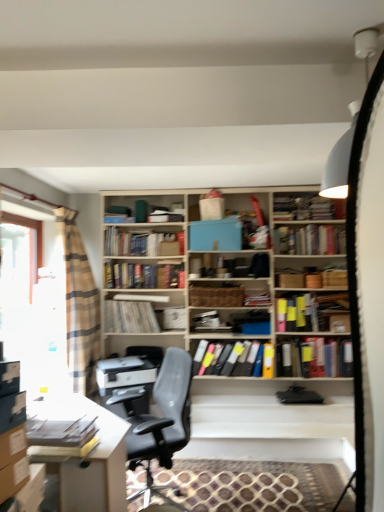
The height and width of the screenshot is (512, 384). What do you see at coordinates (134, 243) in the screenshot? I see `hardcover book at center, the 7th book viewed from the front` at bounding box center [134, 243].

The image size is (384, 512). Identify the location of hardcover book at center, which appears as the 2th book when viewed from the back. (134, 243).

What do you see at coordinates (79, 306) in the screenshot? I see `beige plaid curtain at left` at bounding box center [79, 306].

Describe the element at coordinates (64, 437) in the screenshot. I see `matte gray book at lower left, the first book when ordered from front to back` at that location.

What is the approximate width of brown woven basket at center?

brown woven basket at center is 26.05 centimeters in width.

The width and height of the screenshot is (384, 512). What do you see at coordinates (160, 418) in the screenshot? I see `black leather chair at center` at bounding box center [160, 418].

This screenshot has height=512, width=384. I want to click on hardcover book at center, the 7th book viewed from the front, so click(x=134, y=243).

Considering their positions, is hardcover books at center, positioned as the sixth book in front-to-back order, located in front of or behind beige plaid curtain at left?

hardcover books at center, positioned as the sixth book in front-to-back order, is behind beige plaid curtain at left.

You are a GUI agent. You are given a task and a screenshot of the screen. Output one action in this format:
    pyautogui.click(x=<x>, y=<y>)
    Task: Click on the curtain lying on the left of hardcover books at center, which is counted as the third book, starting from the back
    Image resolution: width=384 pixels, height=512 pixels.
    Given the screenshot: What is the action you would take?
    pyautogui.click(x=79, y=306)

Is hardcover books at center, which is counted as the third book, starting from the back, oriented towards beige plaid curtain at left?

No, hardcover books at center, which is counted as the third book, starting from the back, is not oriented towards beige plaid curtain at left.

From the picture: Between white paper at center, the 1th book when ordered from back to front, and matte white desk at lower left, which one appears on the left side from the viewer's perspective?

matte white desk at lower left.

Is white paper at center, the eighth book positioned from the front, in front of or behind matte white desk at lower left in the image?

Clearly, white paper at center, the eighth book positioned from the front, is behind matte white desk at lower left.

From the image's perspective, which one is positioned lower, white paper at center, the 1th book when ordered from back to front, or matte white desk at lower left?

matte white desk at lower left is shown below in the image.

Between white paper at center, the eighth book positioned from the front, and matte white desk at lower left, which one has less height?

Standing shorter between the two is white paper at center, the eighth book positioned from the front.

Does black leather chair at center lie in front of clear glass window at left?

Yes, black leather chair at center is in front of clear glass window at left.

Is black leather chair at center looking in the opposite direction of clear glass window at left?

No, black leather chair at center's orientation is not away from clear glass window at left.

Is black leather chair at center positioned far away from clear glass window at left?

black leather chair at center is positioned a significant distance from clear glass window at left.

From the picture: Who is taller, black leather chair at center or clear glass window at left?

With more height is clear glass window at left.

Does hardcover books at upper right, marked as the 4th book in a front-to-back arrangement, turn towards white paper at center, the 1th book when ordered from back to front?

No.

How many degrees apart are the facing directions of hardcover books at upper right, the fifth book positioned from the back, and white paper at center, the 1th book when ordered from back to front?

There is a 1.74-degree angle between the facing directions of hardcover books at upper right, the fifth book positioned from the back, and white paper at center, the 1th book when ordered from back to front.

Looking at this image, from a real-world perspective, between hardcover books at upper right, marked as the 4th book in a front-to-back arrangement, and white paper at center, the 1th book when ordered from back to front, who is vertically lower?

In real-world perspective, white paper at center, the 1th book when ordered from back to front, is lower.

Does multicolored plastic folders at center, positioned as the sixth book in back-to-front order, have a lesser height compared to hardcover books at center, which is counted as the third book, starting from the back?

No.

From the image's perspective, which one is positioned higher, multicolored plastic folders at center, positioned as the sixth book in back-to-front order, or hardcover books at center, positioned as the sixth book in front-to-back order?

From the image's view, hardcover books at center, positioned as the sixth book in front-to-back order, is above.

Which point is more distant from viewer, (308, 338) or (131, 275)?

The point (131, 275) is more distant.

Is multicolored plastic folders at center, which is the 3th book from front to back, oriented towards hardcover books at center, positioned as the sixth book in front-to-back order?

No, multicolored plastic folders at center, which is the 3th book from front to back, is not oriented towards hardcover books at center, positioned as the sixth book in front-to-back order.

The height and width of the screenshot is (512, 384). Find the location of `desk located underneath the hardcover books at upper right, the fifth book positioned from the back (from a real-world perspective)`. desk located underneath the hardcover books at upper right, the fifth book positioned from the back (from a real-world perspective) is located at coordinates (90, 461).

Is hardcover books at upper right, the fifth book positioned from the back, oriented away from matte white desk at lower left?

That's not correct — hardcover books at upper right, the fifth book positioned from the back, is not looking away from matte white desk at lower left.

Measure the distance from hardcover books at upper right, marked as the 4th book in a front-to-back arrangement, to matte white desk at lower left.

The distance of hardcover books at upper right, marked as the 4th book in a front-to-back arrangement, from matte white desk at lower left is 2.52 meters.

Considering the positions of objects hardcover books at upper right, the fifth book positioned from the back, and matte white desk at lower left in the image provided, who is behind, hardcover books at upper right, the fifth book positioned from the back, or matte white desk at lower left?

Positioned behind is hardcover books at upper right, the fifth book positioned from the back.

Is the depth of brown woven basket at center less than that of hardcover book at center, the 7th book viewed from the front?

Yes, brown woven basket at center is in front of hardcover book at center, the 7th book viewed from the front.

Is brown woven basket at center not near hardcover book at center, which appears as the 2th book when viewed from the back?

brown woven basket at center is actually quite close to hardcover book at center, which appears as the 2th book when viewed from the back.

From a real-world perspective, is brown woven basket at center physically located above or below hardcover book at center, the 7th book viewed from the front?

From a real-world perspective, brown woven basket at center is physically below hardcover book at center, the 7th book viewed from the front.

Locate an element on the screen. This screenshot has height=512, width=384. curtain below the hardcover books at center, positioned as the sixth book in front-to-back order (from a real-world perspective) is located at coordinates (79, 306).

The width and height of the screenshot is (384, 512). In order to click on the 4th book above the matte white desk at lower left (from the image's perspective) in this screenshot , I will do `click(171, 318)`.

From the image, which object appears to be nearer to matte white desk at lower left, matte gray book at lower left, the first book when ordered from front to back, or white paper at center, the eighth book positioned from the front?

matte gray book at lower left, the first book when ordered from front to back, is positioned closer to the anchor matte white desk at lower left.

From the image, which object appears to be nearer to beige plaid curtain at left, hardcover books at upper right, marked as the 4th book in a front-to-back arrangement, or white paper at center, the 1th book when ordered from back to front?

The object closer to beige plaid curtain at left is white paper at center, the 1th book when ordered from back to front.

Looking at the image, which one is located closer to matte gray book at lower left, the 8th book viewed from the back, matte white desk at lower left or hardcover books at upper right, the fifth book positioned from the back?

matte white desk at lower left lies closer to matte gray book at lower left, the 8th book viewed from the back, than the other object.

Which object lies further to the anchor point beige plaid curtain at left, hardcover book at center, the 7th book viewed from the front, or brown woven basket at center?

Based on the image, brown woven basket at center appears to be further to beige plaid curtain at left.

Based on their spatial positions, is clear glass window at left or white paper at center, the eighth book positioned from the front, further from matte white desk at lower left?

Based on the image, white paper at center, the eighth book positioned from the front, appears to be further to matte white desk at lower left.

From the image, which object appears to be farther from matte gray book at lower left, the 8th book viewed from the back, hardcover book at center, the 7th book viewed from the front, or hardcover books at upper right, marked as the 4th book in a front-to-back arrangement?

Based on the image, hardcover books at upper right, marked as the 4th book in a front-to-back arrangement, appears to be further to matte gray book at lower left, the 8th book viewed from the back.

From the image, which object appears to be farther from beige plaid curtain at left, matte gray book at lower left, the first book when ordered from front to back, or multicolored plastic folders at center, positioned as the sixth book in back-to-front order?

multicolored plastic folders at center, positioned as the sixth book in back-to-front order, is positioned further to the anchor beige plaid curtain at left.

Estimate the real-world distances between objects in this image. Which object is further from clear glass window at left, wooden bookshelf at center, the 4th book viewed from the back, or hardcover books at center, which is counted as the third book, starting from the back?

The object further to clear glass window at left is wooden bookshelf at center, the 4th book viewed from the back.

Find the location of `curtain between hardcover book at center, the 7th book viewed from the front, and wooden bookshelf at center, the 4th book viewed from the back, vertically`. curtain between hardcover book at center, the 7th book viewed from the front, and wooden bookshelf at center, the 4th book viewed from the back, vertically is located at coordinates (79, 306).

At what (x,y) coordinates should I click in order to perform the action: click on book positioned between matte white desk at lower left and brown woven basket at center from near to far. Please return your answer as a coordinate pair (x, y). Image resolution: width=384 pixels, height=512 pixels. Looking at the image, I should click on (230, 358).

You are a GUI agent. You are given a task and a screenshot of the screen. Output one action in this format:
    pyautogui.click(x=<x>, y=<y>)
    Task: Click on the shelf located between beige plaid curtain at left and multicolored plastic folders at center, which is the 3th book from front to back, in the left-right direction
    
    Given the screenshot: What is the action you would take?
    pyautogui.click(x=225, y=296)

This screenshot has width=384, height=512. I want to click on window screen between matte gray book at lower left, the 8th book viewed from the back, and white paper at center, the eighth book positioned from the front, from front to back, so click(18, 292).